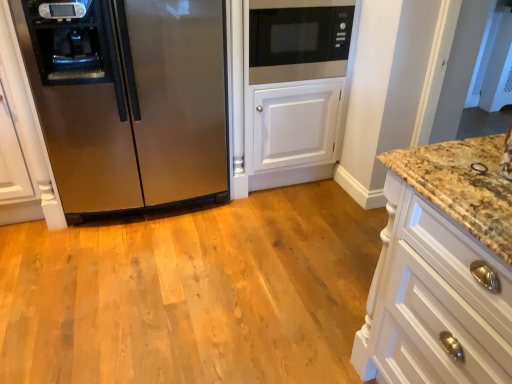
Find the location of a particular element. This screenshot has height=384, width=512. spots to the right of stainless steel refrigerator at left is located at coordinates (271, 229).